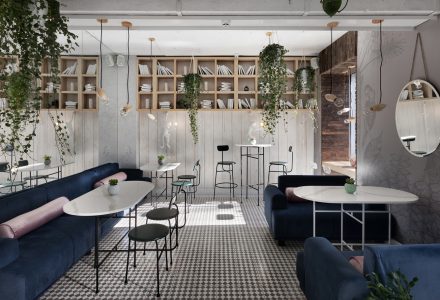
Where is `flower pot`? This screenshot has height=300, width=440. flower pot is located at coordinates (109, 189), (159, 160), (348, 186), (252, 140).